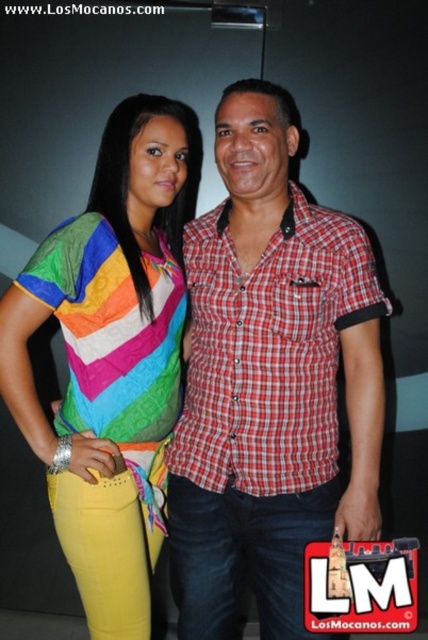
You are a photographer trying to focus on the red checkered shirt at center in the image. What are the coordinates where you should aim your camera?

The coordinates to focus on the red checkered shirt at center are point [270,381].

You are a photographer setting up a shoot with two models wearing the red checkered shirt at center and the rainbow fabric shirt at center. You want to place a spotlight on the model closer to the camera. Which model should you shine the spotlight on?

The red checkered shirt at center is closer to the camera than the rainbow fabric shirt at center, so you should shine the spotlight on the model wearing the red checkered shirt at center.

You are a photographer adjusting the focus of your camera. You need to focus on the two points in the image labeled as point (372, 380) and point (79, 422). Which point should you focus on first to ensure the person closer to the camera is in sharp focus?

Point (372, 380) is closer to the viewer than point (79, 422), so focusing on point (372, 380) first will ensure the person closer to the camera is in sharp focus.